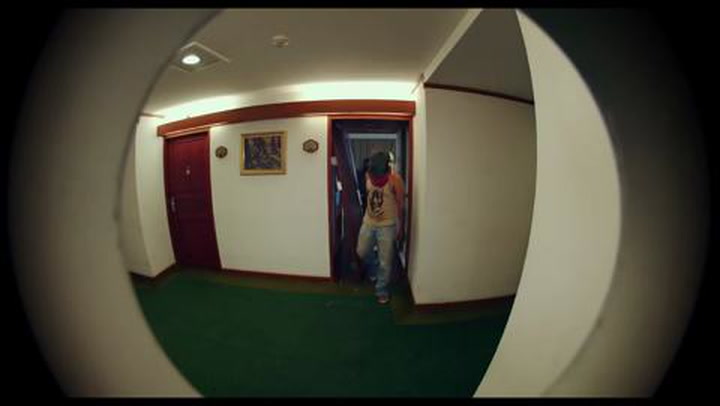
The width and height of the screenshot is (720, 406). Find the location of `artwork`. artwork is located at coordinates (261, 158).